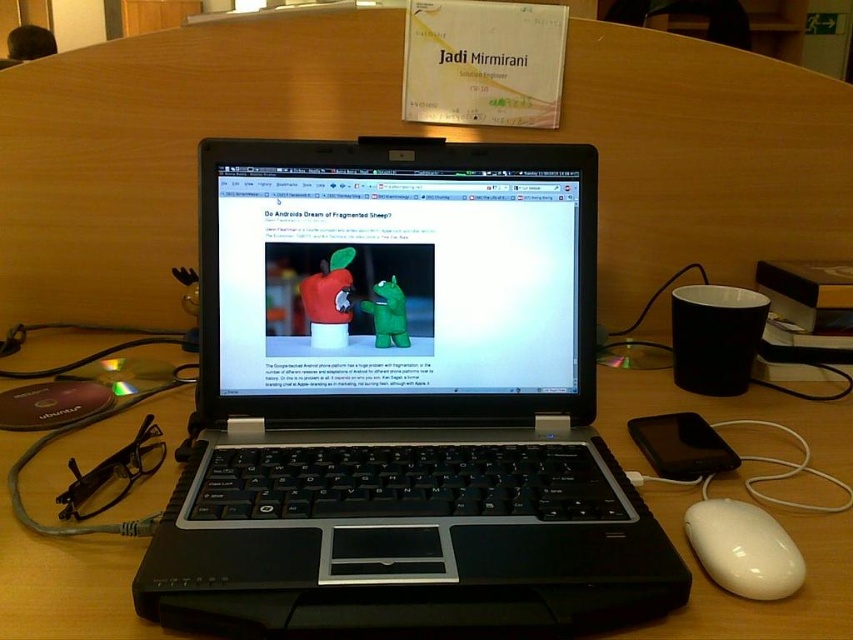
Can you confirm if wooden table at center is shorter than white glossy mouse at lower right?

In fact, wooden table at center may be taller than white glossy mouse at lower right.

Consider the image. Does wooden table at center appear under white glossy mouse at lower right?

No.

Is point (830, 570) behind point (689, 545)?

No.

Where is `wooden table at center`? Image resolution: width=853 pixels, height=640 pixels. wooden table at center is located at coordinates coord(64,576).

Does black plastic laptop at center have a larger size compared to wooden table at center?

Actually, black plastic laptop at center might be smaller than wooden table at center.

Image resolution: width=853 pixels, height=640 pixels. I want to click on black plastic laptop at center, so click(399, 403).

Who is positioned more to the right, shiny black laptop at center or white glossy mouse at lower right?

Positioned to the right is white glossy mouse at lower right.

Is shiny black laptop at center in front of white glossy mouse at lower right?

No, shiny black laptop at center is further to the viewer.

The width and height of the screenshot is (853, 640). What do you see at coordinates (396, 272) in the screenshot?
I see `shiny black laptop at center` at bounding box center [396, 272].

The height and width of the screenshot is (640, 853). What are the coordinates of `shiny black laptop at center` in the screenshot? It's located at (396, 272).